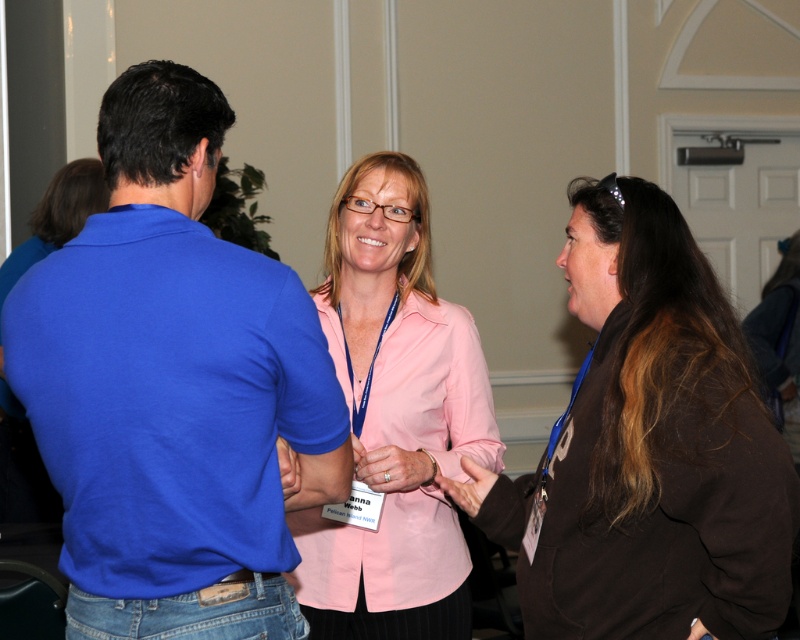
You are a photographer setting up for a group photo. You notice the blue cotton polo shirt at left and the brown soft fabric shirt at center in the scene. Which shirt should you adjust to ensure both are visible in the frame?

The blue cotton polo shirt at left is above the brown soft fabric shirt at center, so you should adjust the brown soft fabric shirt at center to move it upwards to avoid being blocked by the blue cotton polo shirt at left.

You are standing in a room and see a point marked at coordinates (648,448). Based on the scene description, which object does this point lie on?

The point at coordinates (648,448) lies on the brown soft fabric shirt at center.